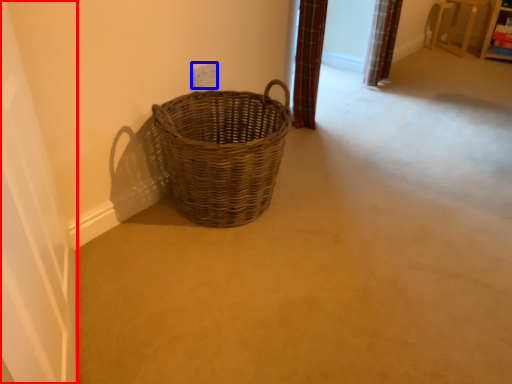
Question: Which of the following is the farthest to the observer, screen door (highlighted by a red box) or electric outlet (highlighted by a blue box)?

Choices:
 (A) screen door
 (B) electric outlet

Answer: (B)